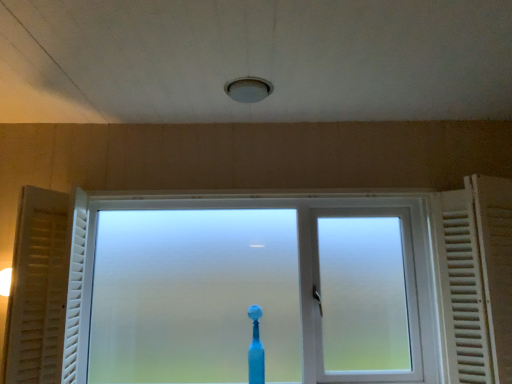
Question: From the image's perspective, is white wooden radiator at right below white matte curtain at left?

Choices:
 (A) yes
 (B) no

Answer: (B)

Question: Is white matte curtain at left at the back of white wooden radiator at right?

Choices:
 (A) yes
 (B) no

Answer: (B)

Question: Is white wooden radiator at right in front of white matte curtain at left?

Choices:
 (A) yes
 (B) no

Answer: (A)

Question: Considering the relative sizes of white wooden radiator at right and white matte curtain at left in the image provided, is white wooden radiator at right shorter than white matte curtain at left?

Choices:
 (A) yes
 (B) no

Answer: (B)

Question: Is white matte curtain at left inside white wooden radiator at right?

Choices:
 (A) yes
 (B) no

Answer: (B)

Question: Considering the relative positions of white wooden radiator at right and white matte curtain at left in the image provided, is white wooden radiator at right to the right of white matte curtain at left from the viewer's perspective?

Choices:
 (A) yes
 (B) no

Answer: (A)

Question: Considering the relative positions of white matte curtain at left and white wooden radiator at right in the image provided, is white matte curtain at left to the right of white wooden radiator at right from the viewer's perspective?

Choices:
 (A) yes
 (B) no

Answer: (B)

Question: From a real-world perspective, is white matte curtain at left beneath white wooden radiator at right?

Choices:
 (A) yes
 (B) no

Answer: (B)

Question: Is white wooden radiator at right a part of white matte curtain at left?

Choices:
 (A) no
 (B) yes

Answer: (A)

Question: Is white matte curtain at left positioned beyond the bounds of white wooden radiator at right?

Choices:
 (A) yes
 (B) no

Answer: (A)

Question: Is white matte curtain at left in contact with white wooden radiator at right?

Choices:
 (A) yes
 (B) no

Answer: (B)

Question: Is white matte curtain at left looking in the opposite direction of white wooden radiator at right?

Choices:
 (A) no
 (B) yes

Answer: (A)

Question: From the image's perspective, would you say white wooden radiator at right is positioned over frosted glass window at center?

Choices:
 (A) no
 (B) yes

Answer: (B)